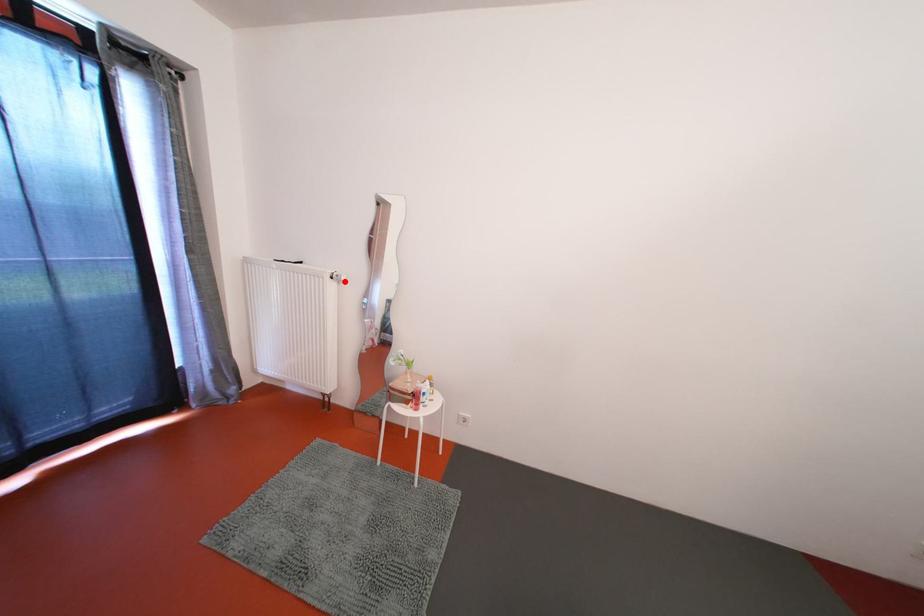
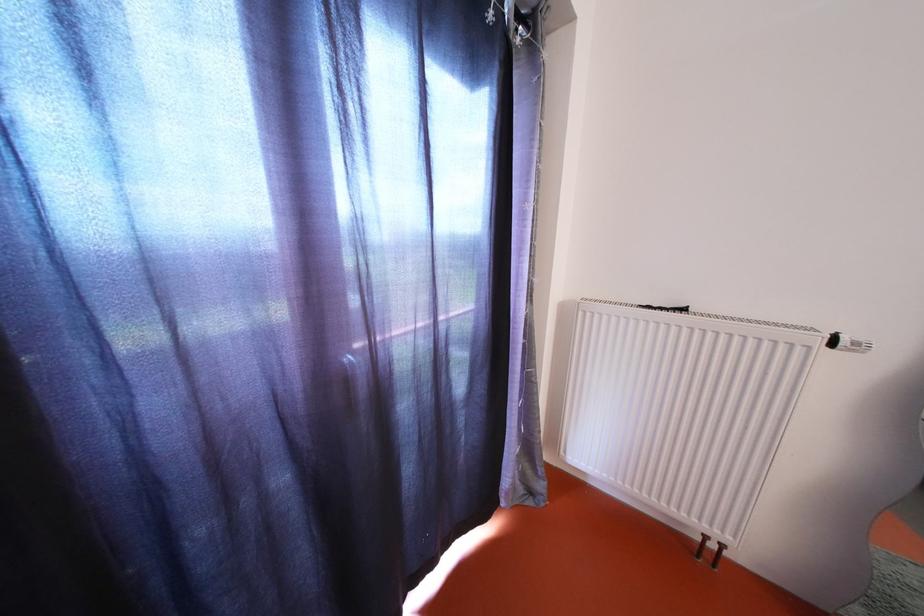
In the second image, find the point that corresponds to the highlighted location in the first image.

(862, 349)